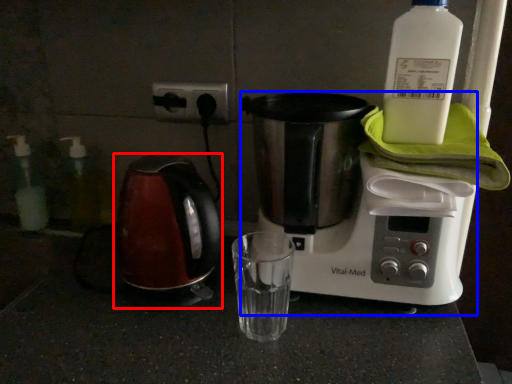
Question: Which object is closer to the camera taking this photo, kettle (highlighted by a red box) or coffee maker (highlighted by a blue box)?

Choices:
 (A) kettle
 (B) coffee maker

Answer: (B)